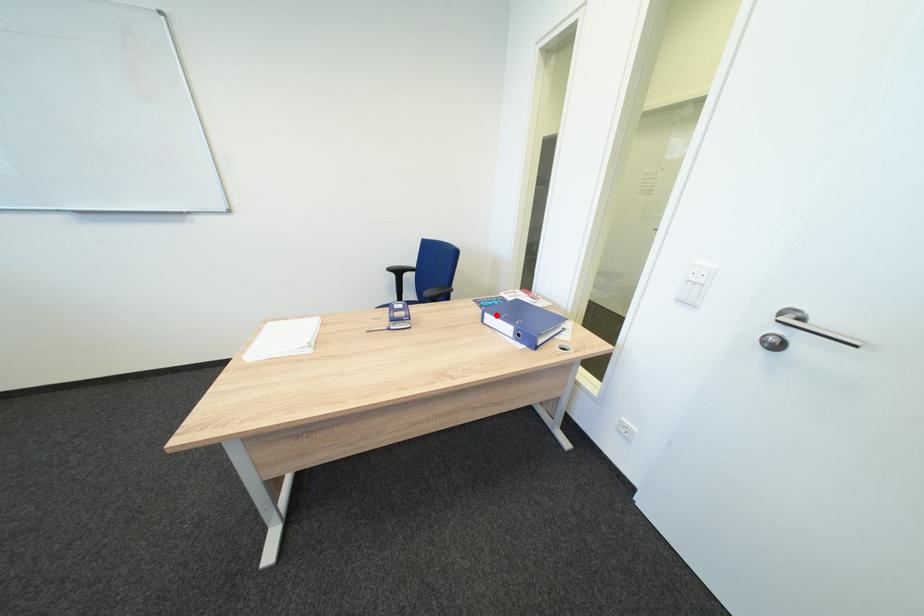
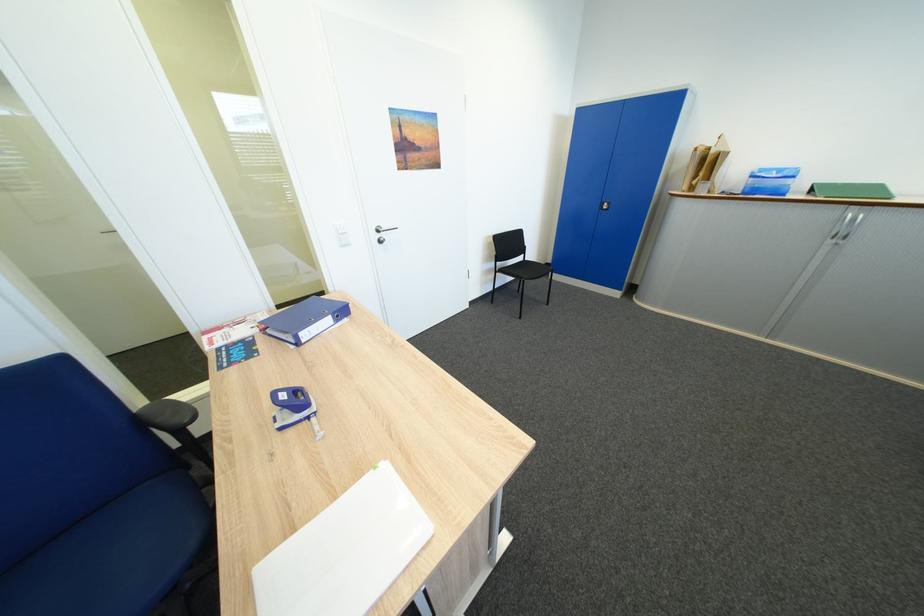
Where in the second image is the point corresponding to the highlighted location from the first image?

(310, 334)